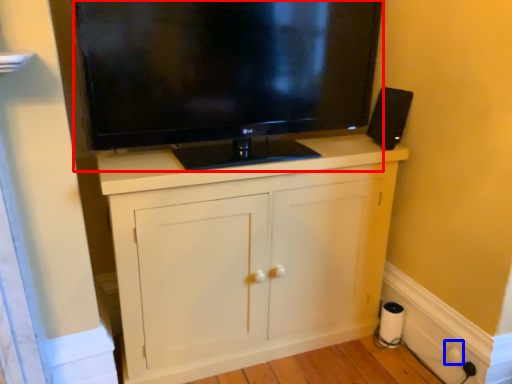
Question: Which object appears farthest to the camera in this image, television (highlighted by a red box) or electric outlet (highlighted by a blue box)?

Choices:
 (A) television
 (B) electric outlet

Answer: (B)